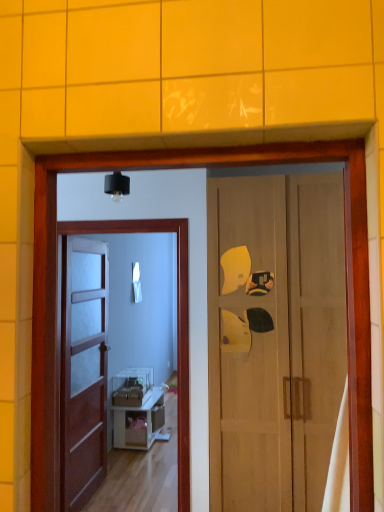
You are a GUI agent. You are given a task and a screenshot of the screen. Output one action in this format:
    pyautogui.click(x=<x>, y=<y>)
    Task: Click on the blank space above clear glass screen door at center (from a real-world perspective)
    
    Given the screenshot: What is the action you would take?
    pyautogui.click(x=115, y=218)